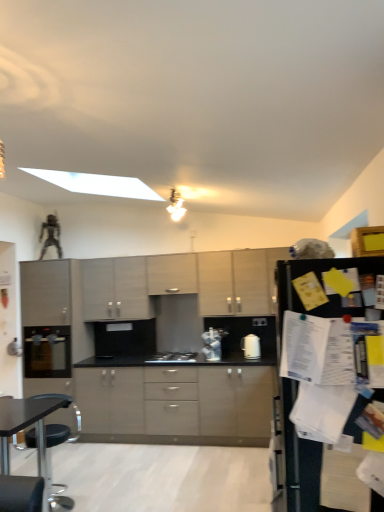
You are a GUI agent. You are given a task and a screenshot of the screen. Output one action in this format:
    pyautogui.click(x=<x>, y=<y>)
    Task: Click on the black plastic chair at lower left
    
    Given the screenshot: What is the action you would take?
    pyautogui.click(x=51, y=469)

What do you see at coordinates (238, 280) in the screenshot? This screenshot has height=512, width=384. I see `matte gray cabinets at center, positioned as the second cabinetry in top-to-bottom order` at bounding box center [238, 280].

This screenshot has width=384, height=512. Describe the element at coordinates (115, 289) in the screenshot. I see `matte gray cabinet at center, acting as the third cabinetry starting from the top` at that location.

Locate an element on the screen. This screenshot has width=384, height=512. white glossy paper towel dispenser at center is located at coordinates (251, 346).

Identify the location of black plastic table at lower left. (25, 425).

Identify the location of matte gray cabinets at center, the first cabinetry ordered from the bottom. (176, 404).

You are a GUI agent. You are given a task and a screenshot of the screen. Output one action in this format:
    pyautogui.click(x=<x>, y=<y>)
    Task: Click on the black matte gas stove at center
    
    Given the screenshot: What is the action you would take?
    click(x=172, y=357)

At what (x,y) coordinates should I click in order to perform the action: click on black plastic chair at lower left. Please return your answer as a coordinate pair (x, y). The image size is (384, 512). Looking at the image, I should click on (51, 469).

Is matte gray cabinets at center, positioned as the second cabinetry in top-to-bottom order, in front of or behind black matte refrigerator at right in the image?

Clearly, matte gray cabinets at center, positioned as the second cabinetry in top-to-bottom order, is behind black matte refrigerator at right.

Is matte gray cabinets at center, positioned as the third cabinetry in bottom-to-top order, inside or outside of black matte refrigerator at right?

The correct answer is: outside.

Considering the sizes of objects matte gray cabinets at center, positioned as the third cabinetry in bottom-to-top order, and black matte refrigerator at right in the image provided, who is smaller, matte gray cabinets at center, positioned as the third cabinetry in bottom-to-top order, or black matte refrigerator at right?

matte gray cabinets at center, positioned as the third cabinetry in bottom-to-top order, is smaller.

Is matte gray cabinets at center, positioned as the third cabinetry in bottom-to-top order, aimed at black matte refrigerator at right?

Yes, matte gray cabinets at center, positioned as the third cabinetry in bottom-to-top order, is oriented towards black matte refrigerator at right.

Considering the sizes of objects matte gray cabinets at center, positioned as the third cabinetry in bottom-to-top order, and matte black oven at left, which is the first appliance in back-to-front order, in the image provided, who is taller, matte gray cabinets at center, positioned as the third cabinetry in bottom-to-top order, or matte black oven at left, which is the first appliance in back-to-front order,?

matte gray cabinets at center, positioned as the third cabinetry in bottom-to-top order, is taller.

Which of these two, matte gray cabinets at center, positioned as the second cabinetry in top-to-bottom order, or matte black oven at left, arranged as the 1th appliance when viewed from the left, is thinner?

With smaller width is matte gray cabinets at center, positioned as the second cabinetry in top-to-bottom order.

Image resolution: width=384 pixels, height=512 pixels. Find the location of `cabinetry that is the 2nd object located above the matte black oven at left, arranged as the 1th appliance when viewed from the left (from the image's perspective)`. cabinetry that is the 2nd object located above the matte black oven at left, arranged as the 1th appliance when viewed from the left (from the image's perspective) is located at coordinates (238, 280).

Is matte gray cabinets at center, positioned as the third cabinetry in bottom-to-top order, located outside matte black oven at left, which appears as the second appliance when viewed from the front?

That's correct, matte gray cabinets at center, positioned as the third cabinetry in bottom-to-top order, is outside of matte black oven at left, which appears as the second appliance when viewed from the front.

From a real-world perspective, which object stands above the other?

From a 3D spatial view, black plastic table at lower left is above.

Locate an element on the screen. The width and height of the screenshot is (384, 512). table lying above the black plastic chair at lower left (from the image's perspective) is located at coordinates [25, 425].

Is black plastic table at lower left facing towards black plastic chair at lower left?

No, black plastic table at lower left does not turn towards black plastic chair at lower left.

Does matte gray cabinets at center, positioned as the third cabinetry in bottom-to-top order, appear on the left side of matte gray cabinets at center, marked as the 4th cabinetry in a top-to-bottom arrangement?

No, matte gray cabinets at center, positioned as the third cabinetry in bottom-to-top order, is not to the left of matte gray cabinets at center, marked as the 4th cabinetry in a top-to-bottom arrangement.

Could you tell me if matte gray cabinets at center, positioned as the third cabinetry in bottom-to-top order, is facing matte gray cabinets at center, the first cabinetry ordered from the bottom?

No, matte gray cabinets at center, positioned as the third cabinetry in bottom-to-top order, is not aimed at matte gray cabinets at center, the first cabinetry ordered from the bottom.

Is there a large distance between matte gray cabinets at center, positioned as the third cabinetry in bottom-to-top order, and matte gray cabinets at center, the first cabinetry ordered from the bottom?

Yes, matte gray cabinets at center, positioned as the third cabinetry in bottom-to-top order, and matte gray cabinets at center, the first cabinetry ordered from the bottom, are quite far apart.

Considering the sizes of objects matte gray cabinets at center, positioned as the third cabinetry in bottom-to-top order, and matte gray cabinets at center, the first cabinetry ordered from the bottom, in the image provided, who is bigger, matte gray cabinets at center, positioned as the third cabinetry in bottom-to-top order, or matte gray cabinets at center, the first cabinetry ordered from the bottom,?

matte gray cabinets at center, the first cabinetry ordered from the bottom, is bigger.

From a real-world perspective, is matte black oven at left, which is the first appliance in back-to-front order, physically below white glossy paper towel dispenser at center?

No.

Who is shorter, matte black oven at left, arranged as the 1th appliance when viewed from the left, or white glossy paper towel dispenser at center?

white glossy paper towel dispenser at center.

Is matte black oven at left, which is the first appliance in back-to-front order, next to white glossy paper towel dispenser at center and touching it?

No, matte black oven at left, which is the first appliance in back-to-front order, is not with white glossy paper towel dispenser at center.

In terms of width, does matte black oven at left, which is the first appliance in back-to-front order, look wider or thinner when compared to white glossy paper towel dispenser at center?

Considering their sizes, matte black oven at left, which is the first appliance in back-to-front order, looks broader than white glossy paper towel dispenser at center.

In the scene shown: Is the depth of matte gray cabinet at center, the fourth cabinetry positioned from the bottom, greater than that of black plastic chair at lower left?

Yes, it is behind black plastic chair at lower left.

From the image's perspective, is matte gray cabinet at center, the fourth cabinetry positioned from the bottom, located beneath black plastic chair at lower left?

No, from the image's perspective, matte gray cabinet at center, the fourth cabinetry positioned from the bottom, is not below black plastic chair at lower left.

Considering the sizes of matte gray cabinet at center, placed as the 1th cabinetry when sorted from top to bottom, and black plastic chair at lower left in the image, is matte gray cabinet at center, placed as the 1th cabinetry when sorted from top to bottom, wider or thinner than black plastic chair at lower left?

In the image, matte gray cabinet at center, placed as the 1th cabinetry when sorted from top to bottom, appears to be more narrow than black plastic chair at lower left.

How different are the orientations of matte gray cabinet at center, the fourth cabinetry positioned from the bottom, and black plastic chair at lower left in degrees?

There is a 32.6-degree angle between the facing directions of matte gray cabinet at center, the fourth cabinetry positioned from the bottom, and black plastic chair at lower left.

Does point (4, 403) appear closer or farther from the camera than point (125, 283)?

Point (4, 403) is positioned closer to the camera compared to point (125, 283).

Which object is thinner, black plastic table at lower left or matte gray cabinet at center, acting as the third cabinetry starting from the top?

Thinner between the two is matte gray cabinet at center, acting as the third cabinetry starting from the top.

Would you say black plastic table at lower left is outside matte gray cabinet at center, positioned as the second cabinetry in bottom-to-top order?

Absolutely, black plastic table at lower left is external to matte gray cabinet at center, positioned as the second cabinetry in bottom-to-top order.

From the image's perspective, which one is positioned higher, black plastic table at lower left or matte gray cabinet at center, acting as the third cabinetry starting from the top?

matte gray cabinet at center, acting as the third cabinetry starting from the top.

Where is `the 2nd cabinetry behind the black matte refrigerator at right, starting your count from the anchor`? The image size is (384, 512). the 2nd cabinetry behind the black matte refrigerator at right, starting your count from the anchor is located at coordinates (238, 280).

Locate an element on the screen. This screenshot has width=384, height=512. cabinetry that is the 2nd object located above the matte black oven at left, which is the first appliance in back-to-front order (from the image's perspective) is located at coordinates (238, 280).

Which object lies nearer to the anchor point black plastic chair at lower left, black matte refrigerator at right or black plastic table at lower left?

Based on the image, black plastic table at lower left appears to be nearer to black plastic chair at lower left.

Considering their positions, is white glossy paper towel dispenser at center positioned further to black matte refrigerator at right than black plastic table at lower left?

The object further to black matte refrigerator at right is white glossy paper towel dispenser at center.

Based on their spatial positions, is black plastic chair at lower left or black matte refrigerator at right further from satin silver toaster at center, which ranks as the 1th appliance in right-to-left order?

black matte refrigerator at right is positioned further to the anchor satin silver toaster at center, which ranks as the 1th appliance in right-to-left order.

Which object lies further to the anchor point black plastic table at lower left, white glossy paper towel dispenser at center or matte black oven at left, which appears as the second appliance when viewed from the front?

white glossy paper towel dispenser at center is positioned further to the anchor black plastic table at lower left.

Which object lies further to the anchor point black plastic chair at lower left, matte gray cabinets at center, positioned as the third cabinetry in bottom-to-top order, or black plastic table at lower left?

The object further to black plastic chair at lower left is matte gray cabinets at center, positioned as the third cabinetry in bottom-to-top order.

Based on their spatial positions, is black plastic chair at lower left or matte gray cabinets at center, positioned as the third cabinetry in bottom-to-top order, further from matte gray cabinets at center, marked as the 4th cabinetry in a top-to-bottom arrangement?

black plastic chair at lower left is further to matte gray cabinets at center, marked as the 4th cabinetry in a top-to-bottom arrangement.

Looking at the image, which one is located further to black plastic table at lower left, black matte gas stove at center or satin silver toaster at center, the second appliance when ordered from back to front?

Among the two, satin silver toaster at center, the second appliance when ordered from back to front, is located further to black plastic table at lower left.

Considering their positions, is black plastic chair at lower left positioned further to white glossy paper towel dispenser at center than black matte gas stove at center?

The object further to white glossy paper towel dispenser at center is black plastic chair at lower left.

The height and width of the screenshot is (512, 384). Find the location of `gas stove between matte gray cabinets at center, positioned as the second cabinetry in top-to-bottom order, and matte gray cabinets at center, marked as the 4th cabinetry in a top-to-bottom arrangement, vertically`. gas stove between matte gray cabinets at center, positioned as the second cabinetry in top-to-bottom order, and matte gray cabinets at center, marked as the 4th cabinetry in a top-to-bottom arrangement, vertically is located at coordinates (172, 357).

At what (x,y) coordinates should I click in order to perform the action: click on chair between black matte refrigerator at right and matte black oven at left, which is the first appliance in back-to-front order, from front to back. Please return your answer as a coordinate pair (x, y). The width and height of the screenshot is (384, 512). Looking at the image, I should click on (51, 469).

Locate an element on the screen. chair between black plastic table at lower left and matte black oven at left, which appears as the second appliance when viewed from the front, along the z-axis is located at coordinates (51, 469).

You are a GUI agent. You are given a task and a screenshot of the screen. Output one action in this format:
    pyautogui.click(x=<x>, y=<y>)
    Task: Click on the appliance between black matte refrigerator at right and matte gray cabinets at center, positioned as the third cabinetry in bottom-to-top order, along the z-axis
    Image resolution: width=384 pixels, height=512 pixels.
    Given the screenshot: What is the action you would take?
    pyautogui.click(x=213, y=343)